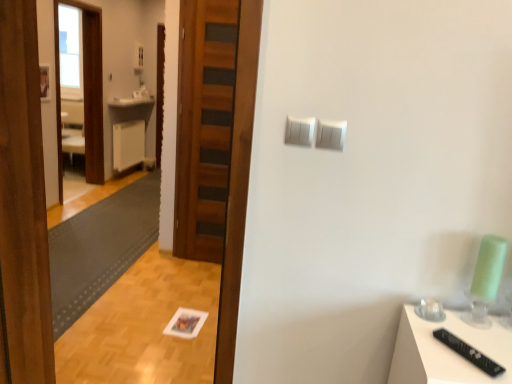
Identify the location of free point to the left of wooden door at center. (170, 261).